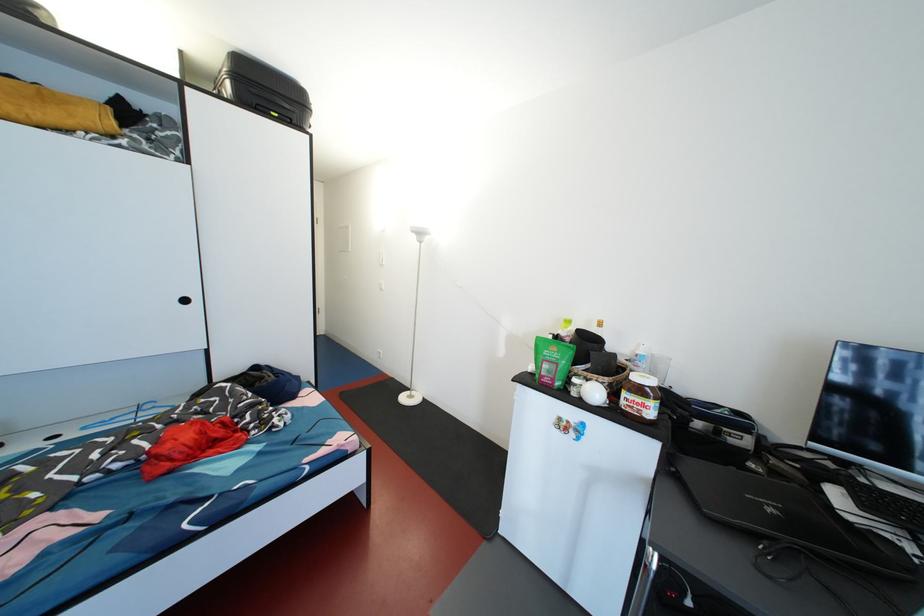
Identify the location of clear drinking glass. The image size is (924, 616). (651, 365).